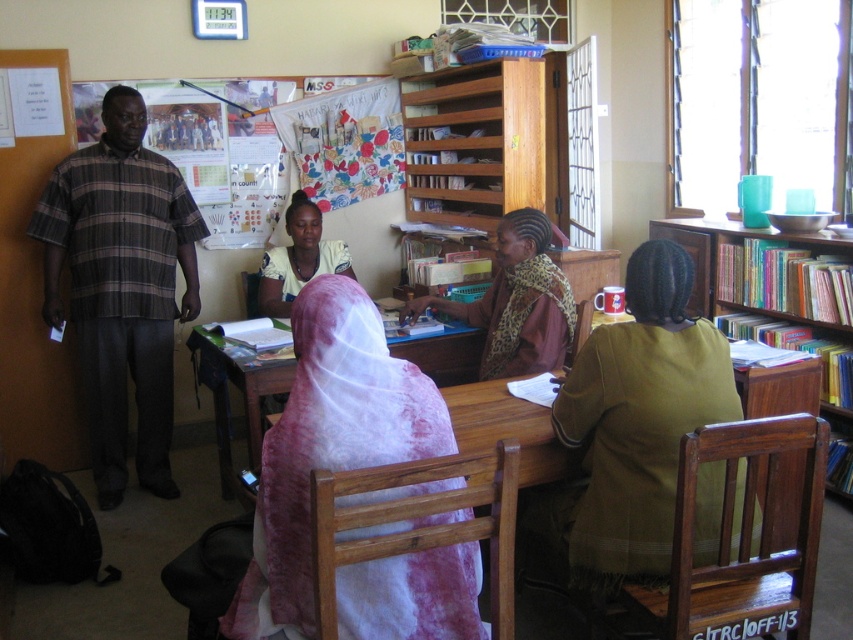
Question: Does plaid cotton shirt at left appear on the right side of leopard print scarf at center?

Choices:
 (A) yes
 (B) no

Answer: (B)

Question: Does white sheer fabric at center appear over wooden bookcase at right?

Choices:
 (A) no
 (B) yes

Answer: (A)

Question: Which object appears farthest from the camera in this image?

Choices:
 (A) matte white headscarf at center
 (B) white sheer fabric at center
 (C) green fabric jacket at lower right

Answer: (A)

Question: Based on their relative distances, which object is nearer to the white sheer fabric at center?

Choices:
 (A) wooden bookcase at right
 (B) matte white headscarf at center
 (C) leopard print scarf at center
 (D) plaid cotton shirt at left

Answer: (C)

Question: Can you confirm if plaid cotton shirt at left is positioned below leopard print scarf at center?

Choices:
 (A) no
 (B) yes

Answer: (B)

Question: Among these points, which one is nearest to the camera?

Choices:
 (A) (280, 280)
 (B) (718, 412)
 (C) (495, 257)
 (D) (799, 260)

Answer: (B)